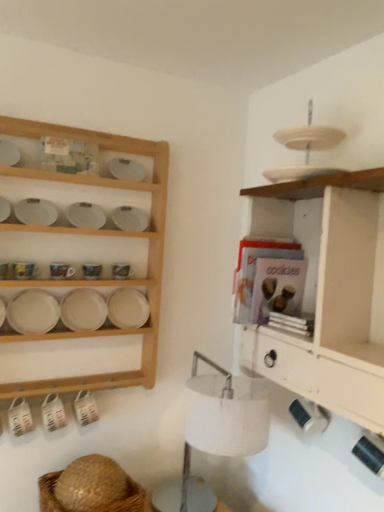
Question: Is the surface of brown woven basket at lower left in direct contact with white wood shelf at right, the second shelf when ordered from left to right?

Choices:
 (A) yes
 (B) no

Answer: (B)

Question: Is brown woven basket at lower left to the left of white wood shelf at right, the second shelf when ordered from left to right, from the viewer's perspective?

Choices:
 (A) no
 (B) yes

Answer: (B)

Question: Is brown woven basket at lower left thinner than white wood shelf at right, the first shelf viewed from the right?

Choices:
 (A) yes
 (B) no

Answer: (B)

Question: From a real-world perspective, is brown woven basket at lower left over white wood shelf at right, the second shelf when ordered from left to right?

Choices:
 (A) yes
 (B) no

Answer: (B)

Question: From a real-world perspective, is brown woven basket at lower left beneath white wood shelf at right, the second shelf when ordered from left to right?

Choices:
 (A) no
 (B) yes

Answer: (B)

Question: Is point 87,381 positioned closer to the camera than point 306,231?

Choices:
 (A) closer
 (B) farther

Answer: (B)

Question: Is white wood shelf at upper left, the 2th shelf viewed from the right, inside or outside of white wood shelf at right, the second shelf when ordered from left to right?

Choices:
 (A) inside
 (B) outside

Answer: (B)

Question: Is white wood shelf at upper left, the first shelf from the left, in front of or behind white wood shelf at right, the first shelf viewed from the right, in the image?

Choices:
 (A) behind
 (B) front

Answer: (A)

Question: Is white wood shelf at upper left, the 2th shelf viewed from the right, taller or shorter than white wood shelf at right, the second shelf when ordered from left to right?

Choices:
 (A) short
 (B) tall

Answer: (B)

Question: Is white wood shelf at right, the second shelf when ordered from left to right, spatially inside white wood shelf at upper left, the first shelf from the left, or outside of it?

Choices:
 (A) inside
 (B) outside

Answer: (B)

Question: From a real-world perspective, is white wood shelf at right, the first shelf viewed from the right, above or below white wood shelf at upper left, the first shelf from the left?

Choices:
 (A) below
 (B) above

Answer: (A)

Question: Is white wood shelf at right, the first shelf viewed from the right, bigger or smaller than white wood shelf at upper left, the 2th shelf viewed from the right?

Choices:
 (A) small
 (B) big

Answer: (B)

Question: Looking at their shapes, would you say white wood shelf at right, the second shelf when ordered from left to right, is wider or thinner than white wood shelf at upper left, the 2th shelf viewed from the right?

Choices:
 (A) wide
 (B) thin

Answer: (A)

Question: Considering their positions, is white matte platter at left located in front of or behind white wood shelf at right, the first shelf viewed from the right?

Choices:
 (A) front
 (B) behind

Answer: (B)

Question: Does point (51, 313) appear closer or farther from the camera than point (312, 350)?

Choices:
 (A) farther
 (B) closer

Answer: (A)